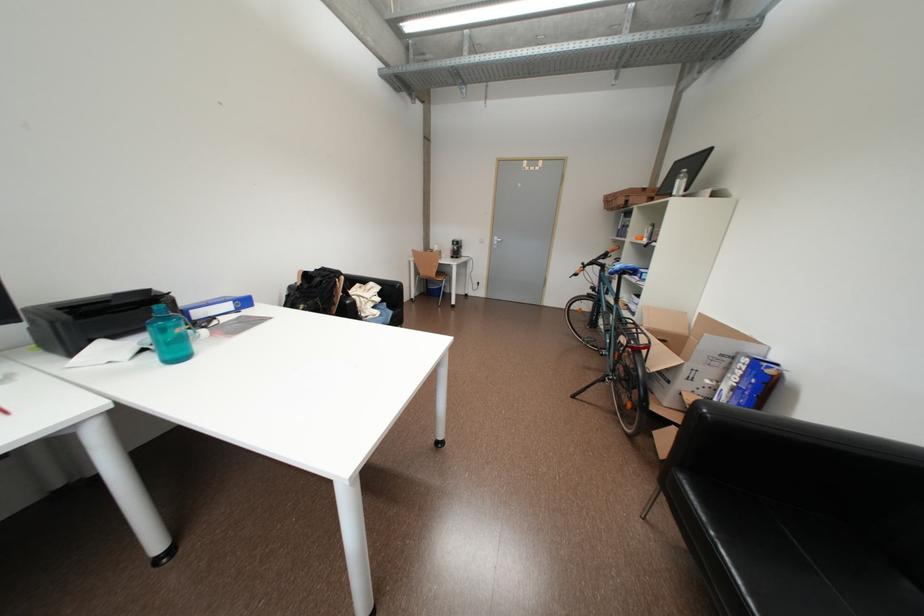
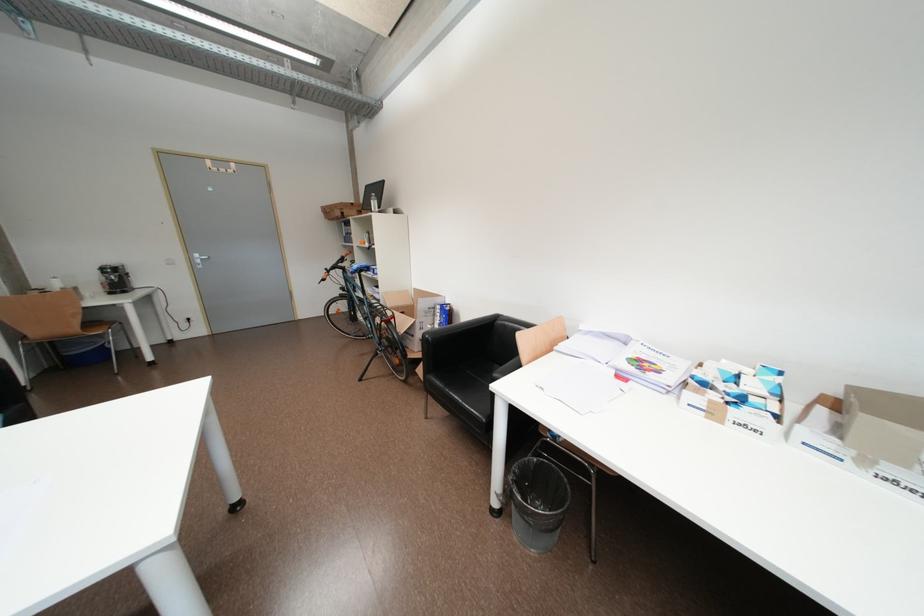
Question: The first image is from the beginning of the video and the second image is from the end. How did the camera likely rotate when shooting the video?

Choices:
 (A) Left
 (B) Right
 (C) Up
 (D) Down

Answer: (B)